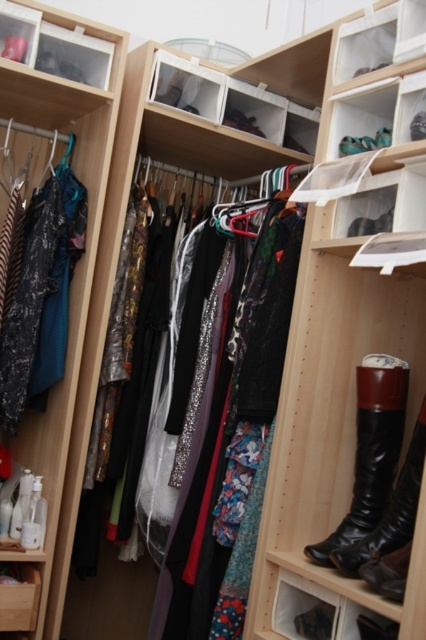
Can you confirm if black leather boot at right is positioned below clear plastic storage at upper left?

Indeed, black leather boot at right is positioned under clear plastic storage at upper left.

Can you confirm if black leather boot at right is bigger than clear plastic storage at upper left?

Correct, black leather boot at right is larger in size than clear plastic storage at upper left.

Which is behind, point (365, 388) or point (6, 29)?

The point (6, 29) is more distant.

This screenshot has height=640, width=426. Identify the location of black leather boot at right. (371, 451).

Who is taller, black leather boot at right or floral fabric dress at center?

floral fabric dress at center

Image resolution: width=426 pixels, height=640 pixels. I want to click on black leather boot at right, so click(x=371, y=451).

Find the location of a particular element. This screenshot has width=426, height=640. black leather boot at right is located at coordinates (371, 451).

You are a GUI agent. You are given a task and a screenshot of the screen. Output one action in this format:
    pyautogui.click(x=<x>, y=<y>)
    Task: Click on the black leather boot at right
    
    Given the screenshot: What is the action you would take?
    pyautogui.click(x=371, y=451)

Is clear plastic storage at upper left to the right of floral fabric dress at center from the viewer's perspective?

Incorrect, clear plastic storage at upper left is not on the right side of floral fabric dress at center.

Does clear plastic storage at upper left come behind floral fabric dress at center?

That is True.

Is point (43, 29) farther from camera compared to point (310, 168)?

That is False.

Locate an element on the screen. clear plastic storage at upper left is located at coordinates (55, 45).